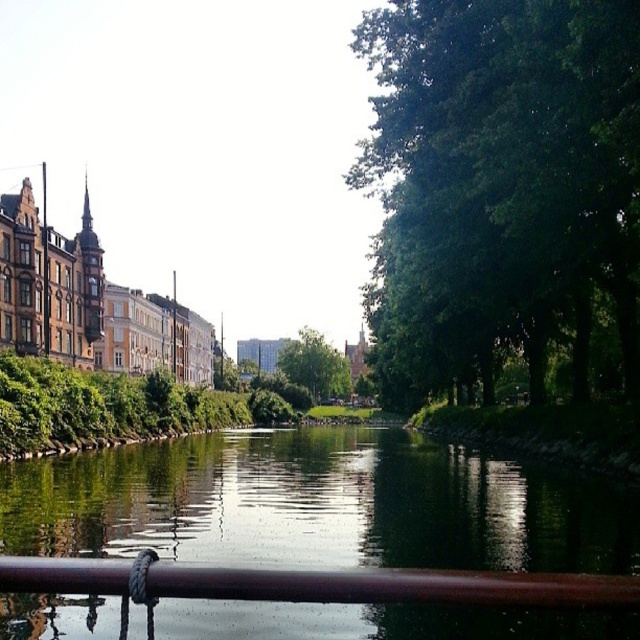
You are standing on the bridge looking at the green leafy trees at right and the green reflective water at center. Which one is positioned to the right side of the other?

The green leafy trees at right are positioned to the right of the green reflective water at center.